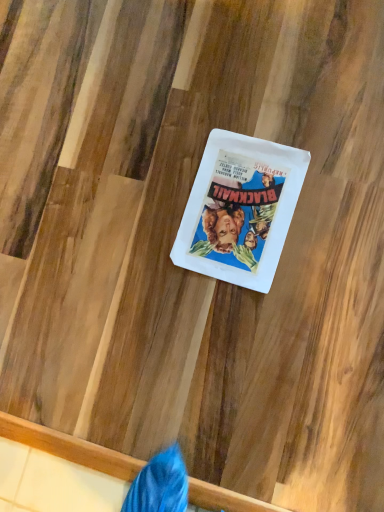
Question: Should I look upward or downward to see white paper at center?

Choices:
 (A) up
 (B) down

Answer: (A)